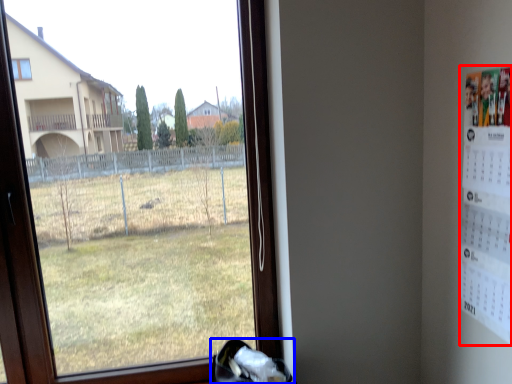
Question: Which of the following is the farthest to the observer, poster (highlighted by a red box) or shoe (highlighted by a blue box)?

Choices:
 (A) poster
 (B) shoe

Answer: (B)